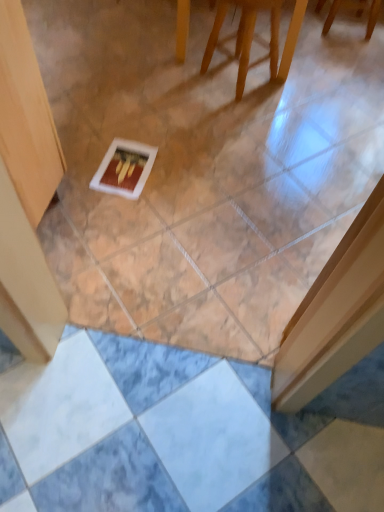
Question: From a real-world perspective, is white matte postcard at center physically below wooden chair at upper center, arranged as the 2th furniture when viewed from the top?

Choices:
 (A) no
 (B) yes

Answer: (B)

Question: Can you confirm if white matte postcard at center is positioned to the left of wooden chair at upper center, which is the 1th furniture from bottom to top?

Choices:
 (A) no
 (B) yes

Answer: (B)

Question: From a real-world perspective, is white matte postcard at center positioned over wooden chair at upper center, marked as the 2th furniture in a back-to-front arrangement, based on gravity?

Choices:
 (A) no
 (B) yes

Answer: (A)

Question: Is white matte postcard at center smaller than wooden chair at upper center, the second furniture from the right?

Choices:
 (A) yes
 (B) no

Answer: (A)

Question: Does white matte postcard at center have a greater width compared to wooden chair at upper center, arranged as the 2th furniture when viewed from the top?

Choices:
 (A) yes
 (B) no

Answer: (A)

Question: Is wooden chair at upper center, which is the 1th furniture from bottom to top, taller or shorter than white matte postcard at center?

Choices:
 (A) short
 (B) tall

Answer: (B)

Question: In terms of size, does wooden chair at upper center, the first furniture from the front, appear bigger or smaller than white matte postcard at center?

Choices:
 (A) small
 (B) big

Answer: (B)

Question: Is point (208, 61) closer or farther from the camera than point (99, 165)?

Choices:
 (A) farther
 (B) closer

Answer: (A)

Question: Is wooden chair at upper center, arranged as the 2th furniture when viewed from the top, wider or thinner than white matte postcard at center?

Choices:
 (A) thin
 (B) wide

Answer: (A)

Question: Looking at their shapes, would you say wooden chair at upper center, which appears as the 2th furniture when viewed from the left, is wider or thinner than wooden chair at upper center, which ranks as the first furniture in left-to-right order?

Choices:
 (A) wide
 (B) thin

Answer: (A)

Question: Is wooden chair at upper center, the second furniture ordered from the bottom, spatially inside wooden chair at upper center, the second furniture from the right, or outside of it?

Choices:
 (A) inside
 (B) outside

Answer: (B)

Question: From the image's perspective, relative to wooden chair at upper center, the first furniture from the front, is wooden chair at upper center, the first furniture viewed from the back, above or below?

Choices:
 (A) above
 (B) below

Answer: (A)

Question: Based on their positions, is wooden chair at upper center, which appears as the 2th furniture when viewed from the left, located to the left or right of wooden chair at upper center, arranged as the 2th furniture when viewed from the top?

Choices:
 (A) left
 (B) right

Answer: (B)

Question: Looking at their shapes, would you say white matte postcard at center is wider or thinner than wooden chair at upper center, which is the first furniture in top-to-bottom order?

Choices:
 (A) wide
 (B) thin

Answer: (B)

Question: Relative to wooden chair at upper center, the first furniture in the right-to-left sequence, is white matte postcard at center in front or behind?

Choices:
 (A) front
 (B) behind

Answer: (A)